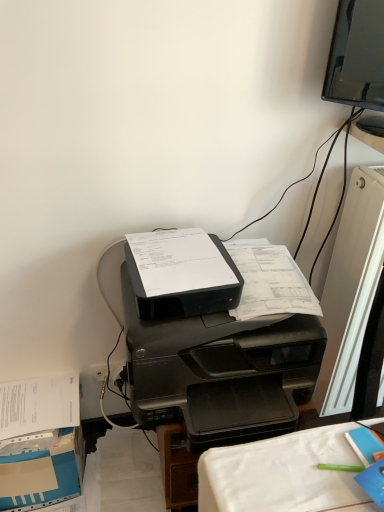
Question: Is point (56, 485) positioned closer to the camera than point (316, 378)?

Choices:
 (A) closer
 (B) farther

Answer: (A)

Question: Considering the relative positions of blue cardboard box at lower left and black plastic printer at center in the image provided, is blue cardboard box at lower left to the left or to the right of black plastic printer at center?

Choices:
 (A) left
 (B) right

Answer: (A)

Question: Which object is positioned farthest from the blue cardboard box at lower left?

Choices:
 (A) black plastic printer at center
 (B) white plastic radiator at right

Answer: (B)

Question: Estimate the real-world distances between objects in this image. Which object is farther from the white plastic radiator at right?

Choices:
 (A) black plastic printer at center
 (B) blue cardboard box at lower left

Answer: (B)